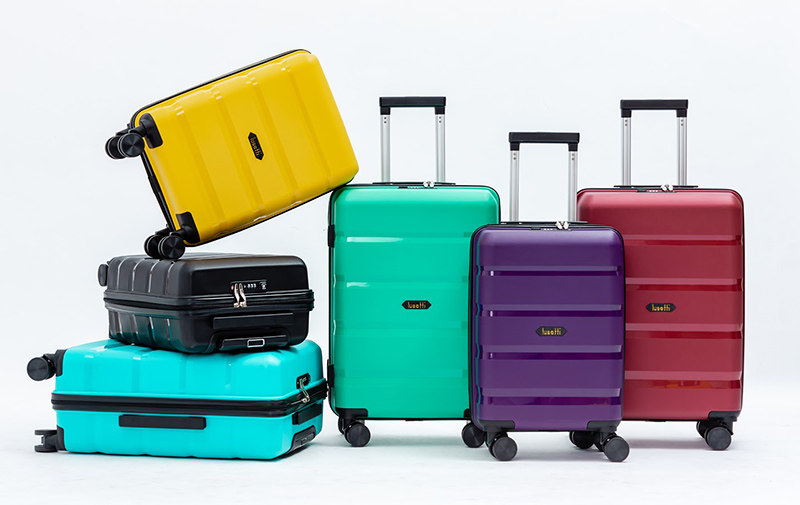
Image resolution: width=800 pixels, height=505 pixels. I want to click on handles, so click(246, 321), click(308, 410), click(402, 98), click(532, 137), click(656, 105).